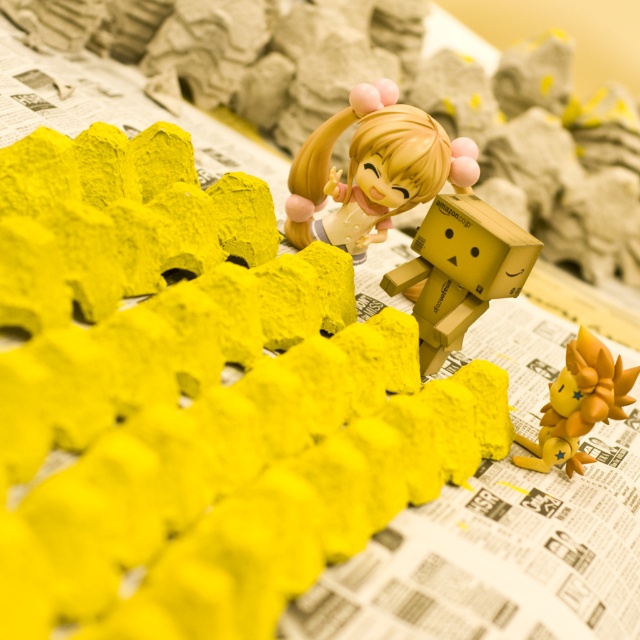
Question: Based on their relative distances, which object is farther from the wooden danbo at center?

Choices:
 (A) smooth plastic doll at center
 (B) orange matte lion at lower right

Answer: (B)

Question: Which object is farther from the camera taking this photo?

Choices:
 (A) orange matte lion at lower right
 (B) wooden danbo at center
 (C) smooth plastic doll at center

Answer: (C)

Question: Which point appears farthest from the camera in this image?

Choices:
 (A) (429, 285)
 (B) (353, 113)
 (C) (611, 385)

Answer: (B)

Question: In this image, where is smooth plastic doll at center located relative to orange matte lion at lower right?

Choices:
 (A) left
 (B) right

Answer: (A)

Question: Is wooden danbo at center positioned in front of orange matte lion at lower right?

Choices:
 (A) yes
 (B) no

Answer: (B)

Question: Is smooth plastic doll at center wider than wooden danbo at center?

Choices:
 (A) yes
 (B) no

Answer: (A)